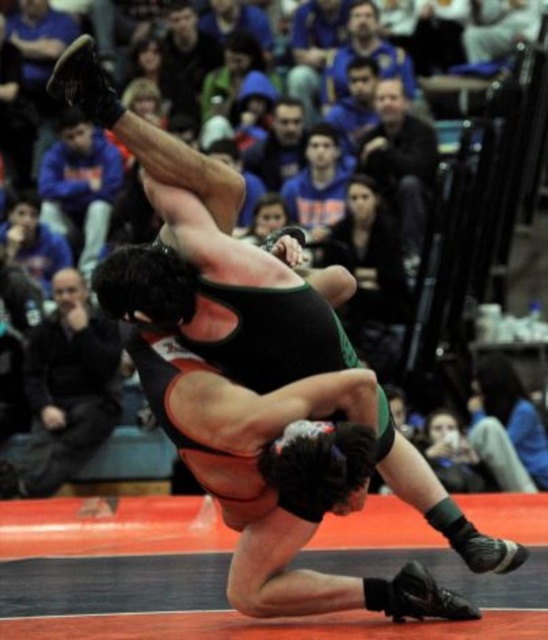
Consider the image. Between blue fleece jacket at upper center and dark blue jacket at upper center, which one is positioned higher?

dark blue jacket at upper center

Does blue fleece jacket at upper center have a larger size compared to dark blue jacket at upper center?

No.

Which is in front, point (94, 148) or point (386, 131)?

Positioned in front is point (386, 131).

Where is `blue fleece jacket at upper center`? blue fleece jacket at upper center is located at coordinates (79, 186).

Can you confirm if black fabric referee at left is positioned to the right of blue fleece jacket at upper center?

Correct, you'll find black fabric referee at left to the right of blue fleece jacket at upper center.

Which is below, black fabric referee at left or blue fleece jacket at upper center?

black fabric referee at left is lower down.

Where is `black fabric referee at left`? This screenshot has height=640, width=548. black fabric referee at left is located at coordinates [66, 390].

Can you confirm if black fabric referee at left is positioned above dark blue jacket at upper center?

No, black fabric referee at left is not above dark blue jacket at upper center.

This screenshot has width=548, height=640. I want to click on black fabric referee at left, so click(66, 390).

Where is `black fabric referee at left`? The height and width of the screenshot is (640, 548). black fabric referee at left is located at coordinates (66, 390).